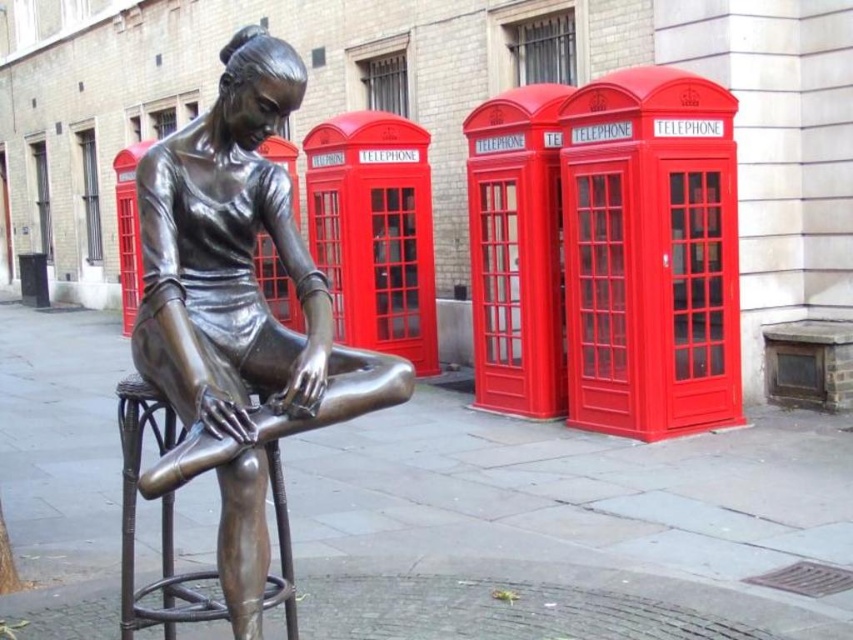
You are a delivery person who needs to place a small package between the bronze statue at center and the bronze textured bar stool at center. Can you fit the package in the space between them if the package is 17 inches long?

The distance between the bronze statue at center and the bronze textured bar stool at center is 16.88 inches. Since the package is 17 inches long, it is slightly longer than the available space. Therefore, the package cannot fit between them.

You are standing in front of the bronze statue at center and want to touch the bronze textured bar stool at center. Is the bar stool within your immediate reach without moving your feet?

The bronze statue at center is closer to the viewer than bronze textured bar stool at center, so the bar stool is farther away. You would need to step forward to reach it.

You are standing at the bronze statue of a ballerina and want to walk towards the point labeled as point (144, 588). However, there is a point labeled as point (225, 204) blocking your path. Will you be able to walk straight to your destination without detouring around the obstacle?

Point (225, 204) is in front of point (144, 588), so you will encounter the obstacle first and need to detour around it to reach your destination.